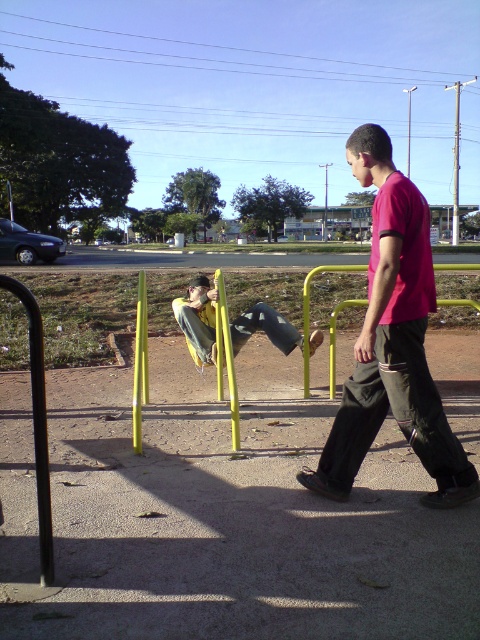
Question: Can you confirm if pink matte shirt at center is positioned to the right of yellow fabric pants at center?

Choices:
 (A) no
 (B) yes

Answer: (B)

Question: Is pink matte shirt at center positioned behind yellow fabric pants at center?

Choices:
 (A) no
 (B) yes

Answer: (A)

Question: Among these objects, which one is farthest from the camera?

Choices:
 (A) pink matte shirt at center
 (B) yellow fabric pants at center

Answer: (B)

Question: Is pink matte shirt at center to the right of yellow fabric pants at center from the viewer's perspective?

Choices:
 (A) no
 (B) yes

Answer: (B)

Question: Which of the following is the closest to the observer?

Choices:
 (A) yellow fabric pants at center
 (B) pink matte shirt at center

Answer: (B)